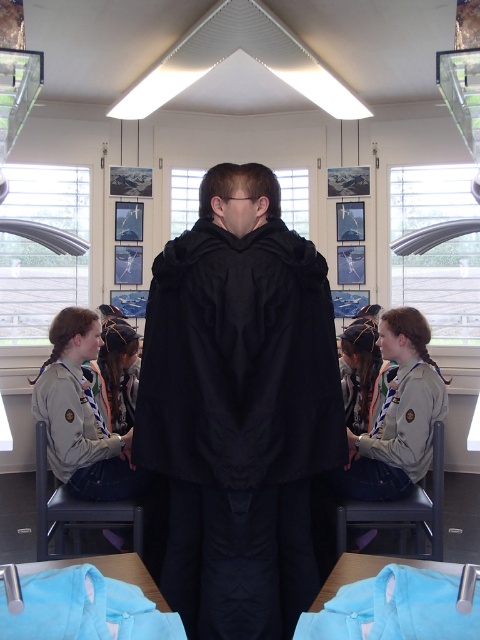
Can you confirm if light blue fabric at lower center is positioned to the right of light blue fabric at lower left?

Indeed, light blue fabric at lower center is positioned on the right side of light blue fabric at lower left.

Does light blue fabric at lower center have a lesser width compared to light blue fabric at lower left?

Yes.

Based on the photo, who is more forward, (479, 609) or (130, 589)?

Point (479, 609) is in front.

The height and width of the screenshot is (640, 480). What are the coordinates of `light blue fabric at lower center` in the screenshot? It's located at click(x=392, y=604).

Who is more distant from viewer, [197,552] or [164,612]?

Positioned behind is point [197,552].

Does black matte robe at center appear under light blue fabric at lower left?

No.

At what (x,y) coordinates should I click in order to perform the action: click on black matte robe at center. Please return your answer as a coordinate pair (x, y). The height and width of the screenshot is (640, 480). Looking at the image, I should click on (239, 408).

Locate an element on the screen. This screenshot has height=640, width=480. black matte robe at center is located at coordinates click(239, 408).

Is point (232, 378) less distant than point (429, 621)?

No, it is not.

Locate an element on the screen. The image size is (480, 640). black matte robe at center is located at coordinates (239, 408).